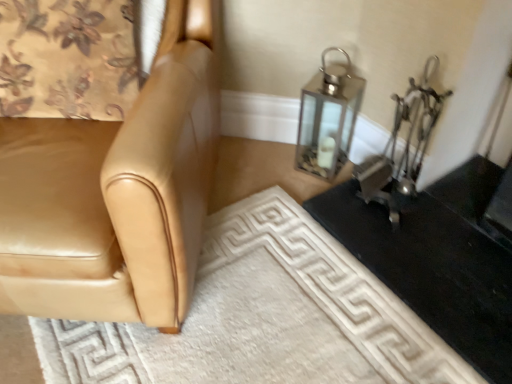
At what (x,y) coordinates should I click in order to perform the action: click on free space to the left of metallic lantern at upper right. Please return your answer as a coordinate pair (x, y). This screenshot has height=384, width=512. Looking at the image, I should click on (269, 165).